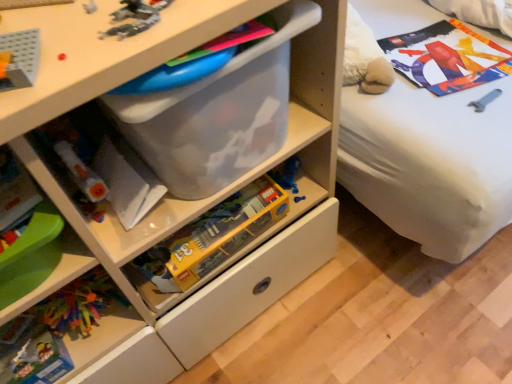
Image resolution: width=512 pixels, height=384 pixels. What are the coordinates of `multicolored plastic toys at lower left` in the screenshot? It's located at click(66, 331).

How much space does translucent plastic lego box at center, the second toy when ordered from top to bottom, occupy horizontally?

It is 6.99 inches.

What do you see at coordinates (135, 17) in the screenshot?
I see `translucent plastic toy at upper left, the first toy when ordered from top to bottom` at bounding box center [135, 17].

Where is `transparent plastic chest of drawers at center`? transparent plastic chest of drawers at center is located at coordinates (183, 200).

Image resolution: width=512 pixels, height=384 pixels. Find the location of `multicolored plastic toys at lower left`. multicolored plastic toys at lower left is located at coordinates (66, 331).

Is multicolored plastic toys at lower left at the left side of translucent plastic toy at upper left, the first toy when ordered from top to bottom?

Yes.

From the image's perspective, does multicolored plastic toys at lower left appear higher than translucent plastic toy at upper left, which is counted as the 2th toy, starting from the back?

No, from the image's perspective, multicolored plastic toys at lower left is not over translucent plastic toy at upper left, which is counted as the 2th toy, starting from the back.

Is point (118, 334) closer to camera compared to point (143, 20)?

No, it is behind (143, 20).

Which of these two, multicolored plastic toys at lower left or translucent plastic toy at upper left, which is counted as the 2th toy, starting from the back, is smaller?

multicolored plastic toys at lower left.

Considering their positions, is multicolored plastic toys at lower left located in front of or behind translucent plastic lego box at center, the first toy when ordered from bottom to top?

In the image, multicolored plastic toys at lower left appears in front of translucent plastic lego box at center, the first toy when ordered from bottom to top.

Between multicolored plastic toys at lower left and translucent plastic lego box at center, the second toy when ordered from top to bottom, which one appears on the left side from the viewer's perspective?

multicolored plastic toys at lower left.

How many degrees apart are the facing directions of multicolored plastic toys at lower left and translucent plastic lego box at center, the first toy when ordered from bottom to top?

1.52 degrees separate the facing orientations of multicolored plastic toys at lower left and translucent plastic lego box at center, the first toy when ordered from bottom to top.

Is multicolored plastic toys at lower left not close to translucent plastic lego box at center, which is the first toy in back-to-front order?

That's not correct — multicolored plastic toys at lower left is a little close to translucent plastic lego box at center, which is the first toy in back-to-front order.

In terms of height, does translucent plastic lego box at center, the second toy when ordered from top to bottom, look taller or shorter compared to transparent plastic chest of drawers at center?

In the image, translucent plastic lego box at center, the second toy when ordered from top to bottom, appears to be shorter than transparent plastic chest of drawers at center.

Which is in front, point (260, 198) or point (120, 61)?

The point (120, 61) is in front.

Between translucent plastic lego box at center, marked as the 2th toy in a front-to-back arrangement, and transparent plastic chest of drawers at center, which one appears on the left side from the viewer's perspective?

From the viewer's perspective, transparent plastic chest of drawers at center appears more on the left side.

Can you tell me how much transparent plastic chest of drawers at center and translucent plastic toy at upper left, the second toy ordered from the bottom, differ in facing direction?

2.07 degrees separate the facing orientations of transparent plastic chest of drawers at center and translucent plastic toy at upper left, the second toy ordered from the bottom.

Between transparent plastic chest of drawers at center and translucent plastic toy at upper left, which is counted as the 2th toy, starting from the back, which one has smaller width?

translucent plastic toy at upper left, which is counted as the 2th toy, starting from the back.

Consider the image. Would you consider transparent plastic chest of drawers at center to be distant from translucent plastic toy at upper left, which is counted as the 2th toy, starting from the back?

transparent plastic chest of drawers at center is near translucent plastic toy at upper left, which is counted as the 2th toy, starting from the back, not far away.

Where is `chest of drawers below the translucent plastic toy at upper left, the first toy when ordered from top to bottom (from a real-world perspective)`? This screenshot has height=384, width=512. chest of drawers below the translucent plastic toy at upper left, the first toy when ordered from top to bottom (from a real-world perspective) is located at coordinates (183, 200).

Can you confirm if translucent plastic lego box at center, which is the first toy in back-to-front order, is wider than translucent plastic toy at upper left, which is counted as the 2th toy, starting from the back?

No.

Which is more to the left, translucent plastic lego box at center, which is the first toy in back-to-front order, or translucent plastic toy at upper left, the first toy when ordered from top to bottom?

translucent plastic toy at upper left, the first toy when ordered from top to bottom.

Identify the location of toy below the translucent plastic toy at upper left, the second toy ordered from the bottom (from a real-world perspective). This screenshot has width=512, height=384. (213, 236).

The image size is (512, 384). I want to click on chest of drawers above the translucent plastic lego box at center, marked as the 2th toy in a front-to-back arrangement (from a real-world perspective), so click(x=183, y=200).

Is transparent plastic chest of drawers at center outside of translucent plastic lego box at center, the first toy when ordered from bottom to top?

Indeed, transparent plastic chest of drawers at center is completely outside translucent plastic lego box at center, the first toy when ordered from bottom to top.

Between transparent plastic chest of drawers at center and translucent plastic lego box at center, the first toy when ordered from bottom to top, which one has larger size?

With larger size is transparent plastic chest of drawers at center.

Can you confirm if transparent plastic chest of drawers at center is positioned to the right of translucent plastic lego box at center, marked as the 2th toy in a front-to-back arrangement?

Incorrect, transparent plastic chest of drawers at center is not on the right side of translucent plastic lego box at center, marked as the 2th toy in a front-to-back arrangement.

You are a GUI agent. You are given a task and a screenshot of the screen. Output one action in this format:
    pyautogui.click(x=<x>, y=<y>)
    Task: Click on the shelf behind the translucent plastic toy at upper left, the first toy when ordered from top to bottom
    The image size is (512, 384).
    Given the screenshot: What is the action you would take?
    pyautogui.click(x=66, y=331)

From the image's perspective, who appears lower, translucent plastic toy at upper left, the second toy ordered from the bottom, or multicolored plastic toys at lower left?

multicolored plastic toys at lower left appears lower in the image.

Is point (108, 29) farther from viewer compared to point (131, 320)?

No, it is not.

Which is more to the right, translucent plastic toy at upper left, the first toy when ordered from top to bottom, or multicolored plastic toys at lower left?

translucent plastic toy at upper left, the first toy when ordered from top to bottom.

The width and height of the screenshot is (512, 384). Find the location of `toy above the multicolored plastic toys at lower left (from a real-world perspective)`. toy above the multicolored plastic toys at lower left (from a real-world perspective) is located at coordinates coord(135,17).

Find the location of a particular element. toy beneath the multicolored plastic toys at lower left (from a real-world perspective) is located at coordinates (213, 236).

Estimate the real-world distances between objects in this image. Which object is further from transparent plastic chest of drawers at center, multicolored plastic toys at lower left or translucent plastic toy at upper left, the second toy ordered from the bottom?

translucent plastic toy at upper left, the second toy ordered from the bottom, is further to transparent plastic chest of drawers at center.

Based on their spatial positions, is translucent plastic toy at upper left, the second toy ordered from the bottom, or transparent plastic chest of drawers at center further from translucent plastic lego box at center, the first toy when ordered from bottom to top?

translucent plastic toy at upper left, the second toy ordered from the bottom.

Looking at the image, which one is located further to translucent plastic lego box at center, the second toy when ordered from top to bottom, multicolored plastic toys at lower left or transparent plastic chest of drawers at center?

The object further to translucent plastic lego box at center, the second toy when ordered from top to bottom, is multicolored plastic toys at lower left.

Which object lies further to the anchor point translucent plastic toy at upper left, the first toy when ordered from top to bottom, multicolored plastic toys at lower left or translucent plastic lego box at center, the first toy when ordered from bottom to top?

Based on the image, multicolored plastic toys at lower left appears to be further to translucent plastic toy at upper left, the first toy when ordered from top to bottom.

When comparing their distances from translucent plastic lego box at center, the second toy when ordered from top to bottom, does transparent plastic chest of drawers at center or translucent plastic toy at upper left, which is counted as the 2th toy, starting from the back, seem closer?

Among the two, transparent plastic chest of drawers at center is located nearer to translucent plastic lego box at center, the second toy when ordered from top to bottom.

Based on their spatial positions, is transparent plastic chest of drawers at center or translucent plastic lego box at center, marked as the 2th toy in a front-to-back arrangement, further from multicolored plastic toys at lower left?

The object further to multicolored plastic toys at lower left is transparent plastic chest of drawers at center.

When comparing their distances from translucent plastic toy at upper left, which is counted as the 2th toy, starting from the back, does transparent plastic chest of drawers at center or multicolored plastic toys at lower left seem closer?

transparent plastic chest of drawers at center.

Based on their spatial positions, is translucent plastic lego box at center, marked as the 2th toy in a front-to-back arrangement, or transparent plastic chest of drawers at center closer to translucent plastic toy at upper left, the second toy ordered from the bottom?

transparent plastic chest of drawers at center is closer to translucent plastic toy at upper left, the second toy ordered from the bottom.

Identify the location of toy between translucent plastic toy at upper left, positioned as the first toy in front-to-back order, and multicolored plastic toys at lower left from top to bottom. (213, 236).

Find the location of a particular element. This screenshot has width=512, height=384. chest of drawers between translucent plastic toy at upper left, the second toy ordered from the bottom, and multicolored plastic toys at lower left from top to bottom is located at coordinates (183, 200).

The height and width of the screenshot is (384, 512). What are the coordinates of `shelf between transparent plastic chest of drawers at center and translucent plastic lego box at center, which is the first toy in back-to-front order, along the z-axis` in the screenshot? It's located at tap(66, 331).

This screenshot has width=512, height=384. I want to click on toy between transparent plastic chest of drawers at center and translucent plastic lego box at center, marked as the 2th toy in a front-to-back arrangement, along the z-axis, so click(135, 17).